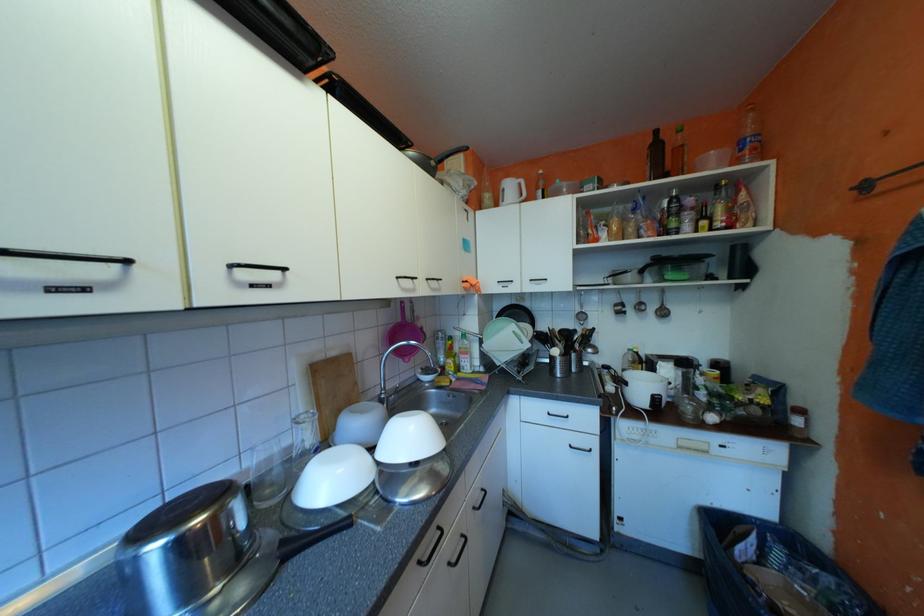
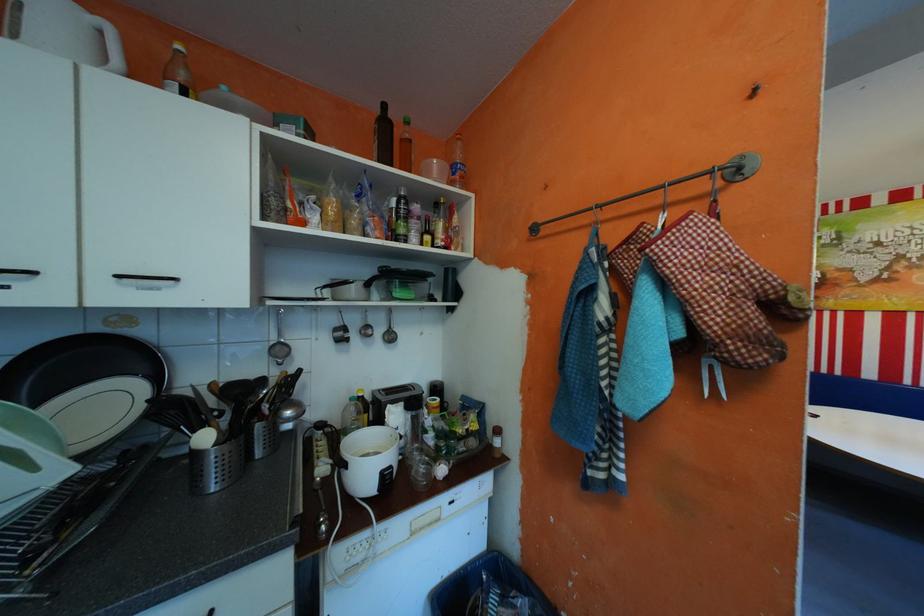
Find the pixel in the second image that matches point (528, 310) in the first image.

(105, 353)